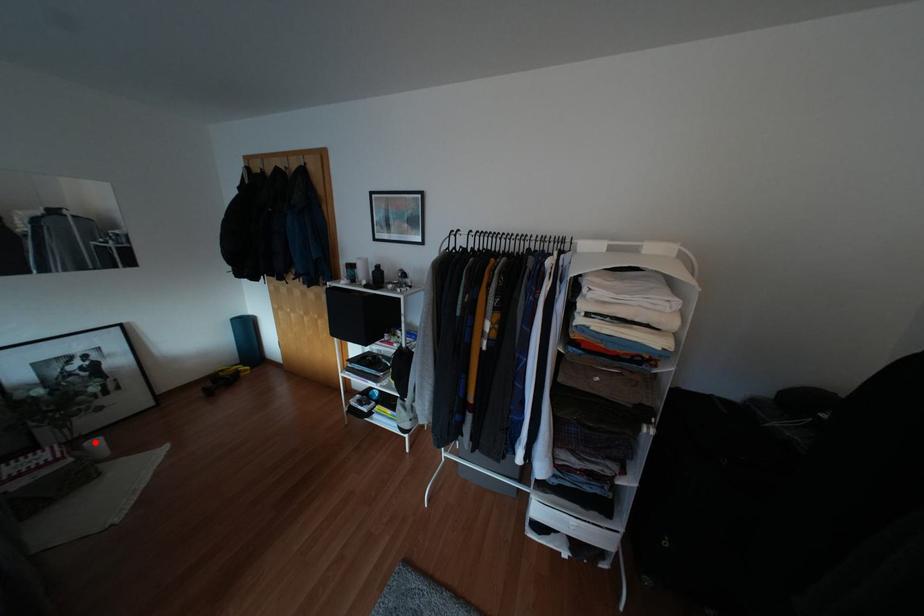
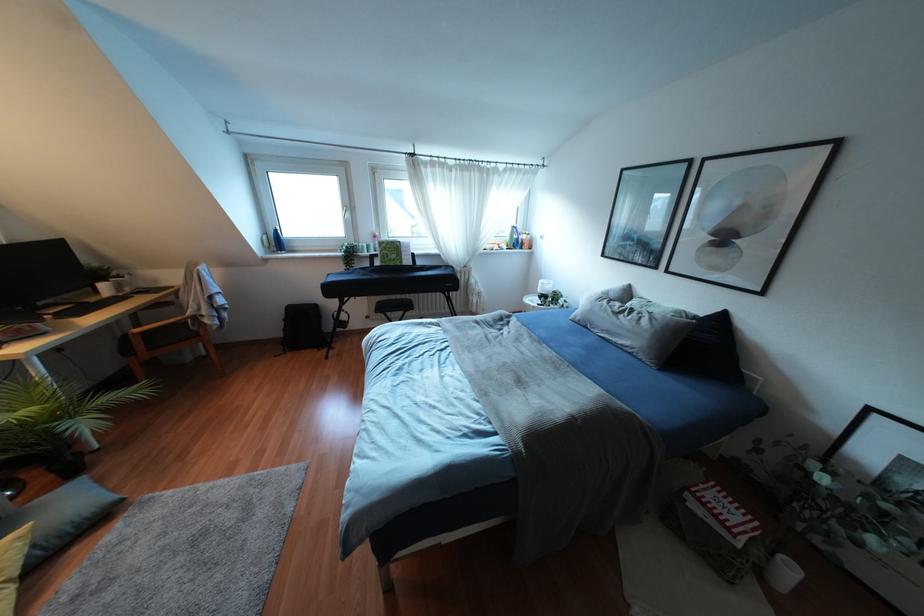
The point at the highlighted location is marked in the first image. Where is the corresponding point in the second image?

(791, 570)